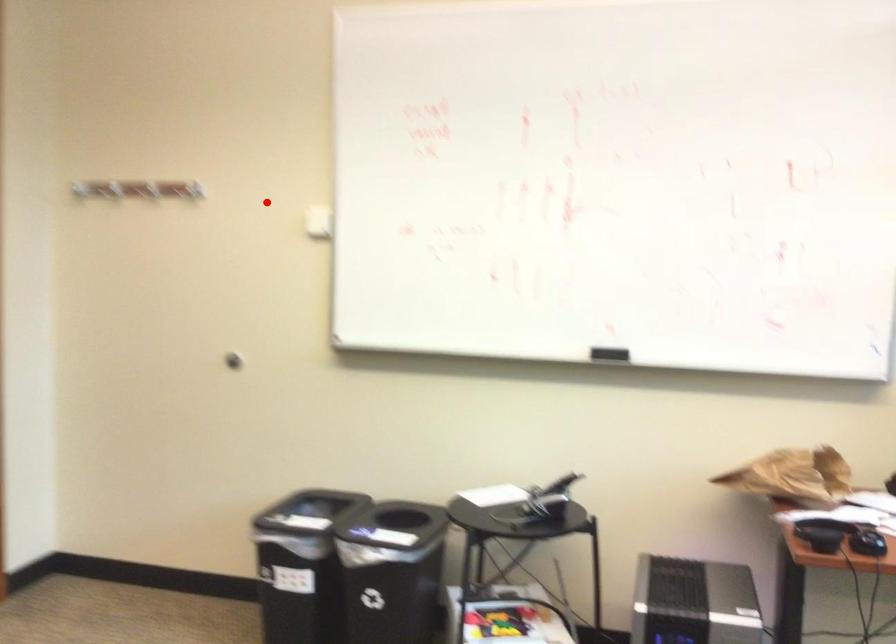
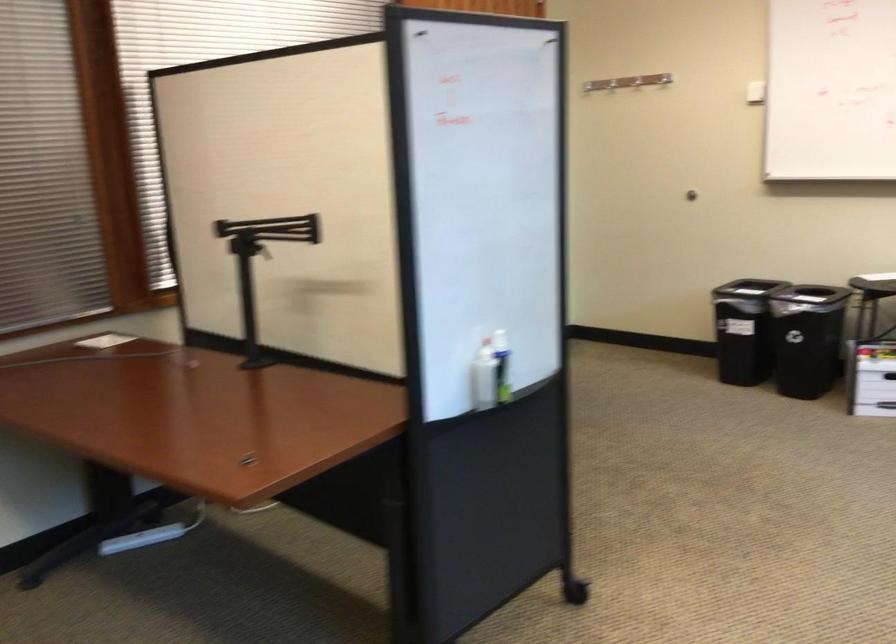
Where in the second image is the point corresponding to the highlighted location from the first image?

(636, 82)